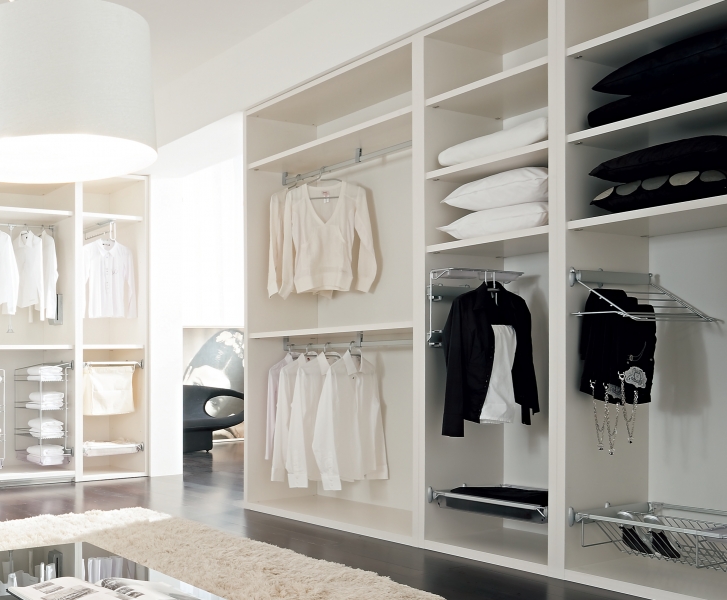
At what (x,y) coordinates should I click in order to perform the action: click on metal shoe rack. Please return your answer as a coordinate pair (x, y). This screenshot has width=727, height=600. Looking at the image, I should click on (699, 537).